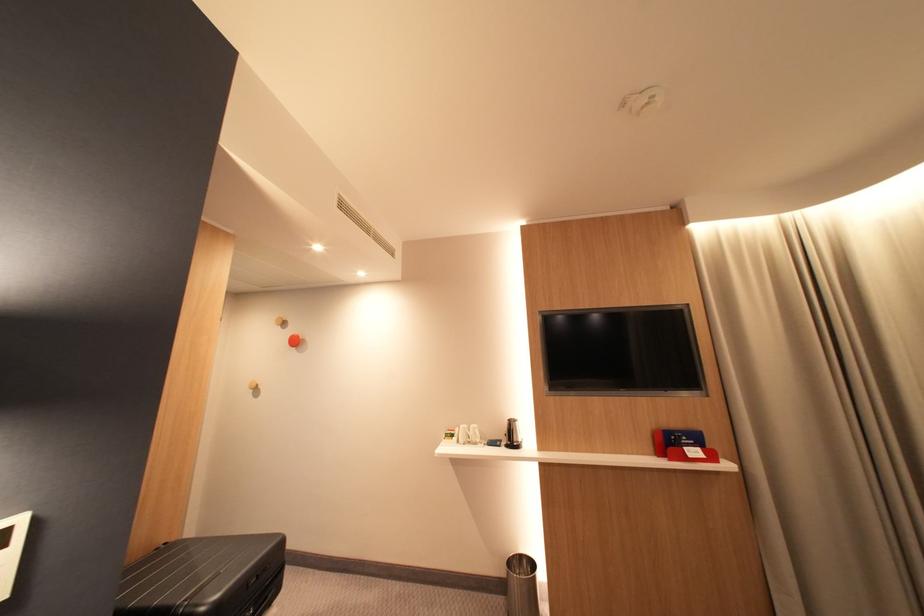
This screenshot has height=616, width=924. What do you see at coordinates (508, 430) in the screenshot?
I see `the kettle handle` at bounding box center [508, 430].